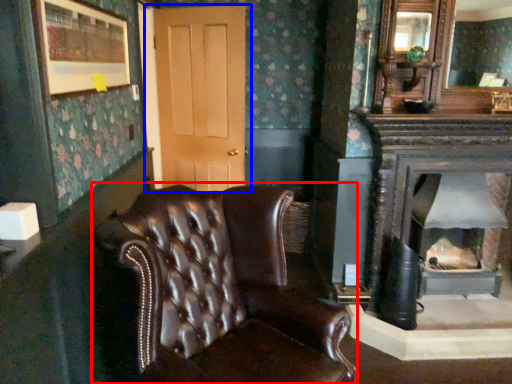
Question: Among these objects, which one is farthest to the camera, chair (highlighted by a red box) or door (highlighted by a blue box)?

Choices:
 (A) chair
 (B) door

Answer: (B)